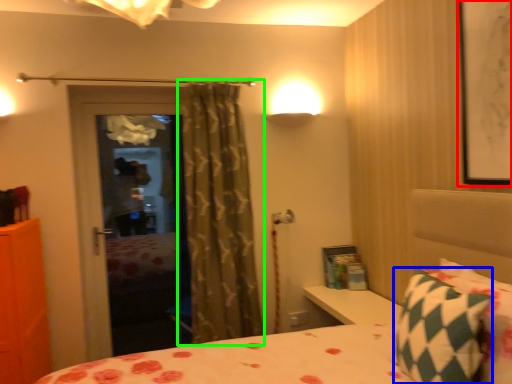
Question: Which is nearer to the picture frame (highlighted by a red box)? pillow (highlighted by a blue box) or curtain (highlighted by a green box).

Choices:
 (A) pillow
 (B) curtain

Answer: (A)